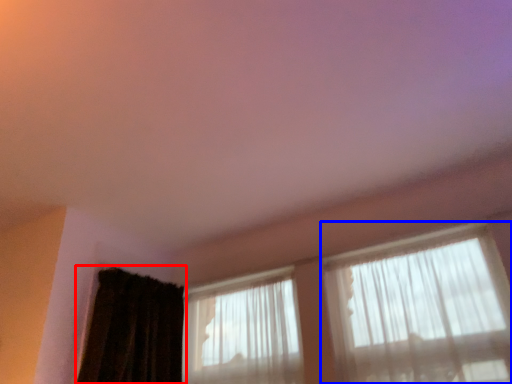
Question: Among these objects, which one is nearest to the camera, curtain (highlighted by a red box) or window (highlighted by a blue box)?

Choices:
 (A) curtain
 (B) window

Answer: (B)